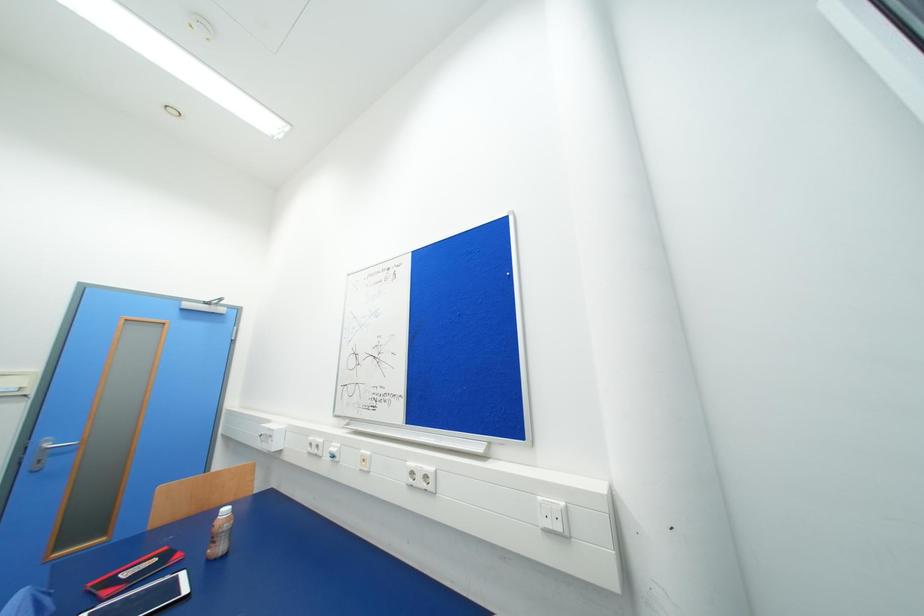
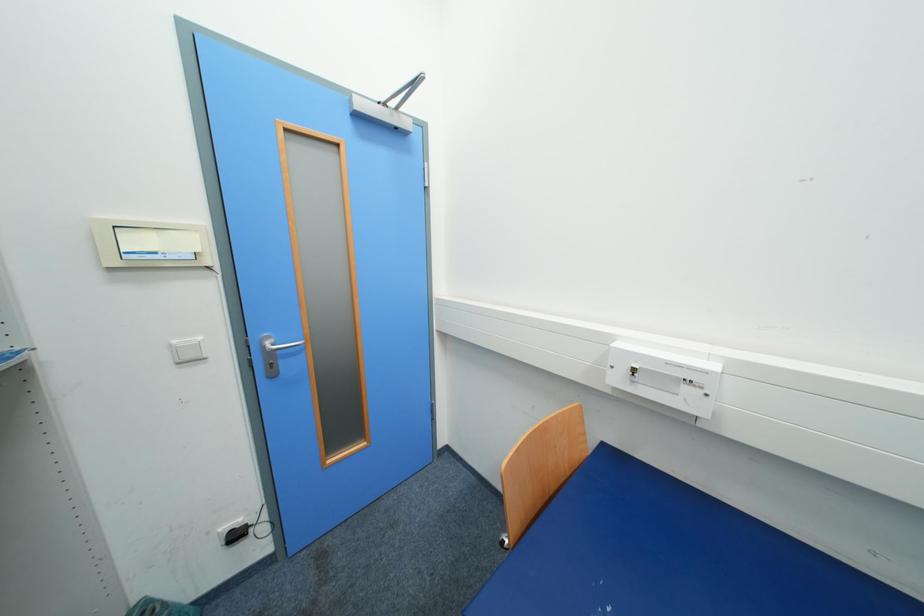
The images are taken continuously from a first-person perspective. In which direction are you moving?

The cameraman moved toward left, forward.